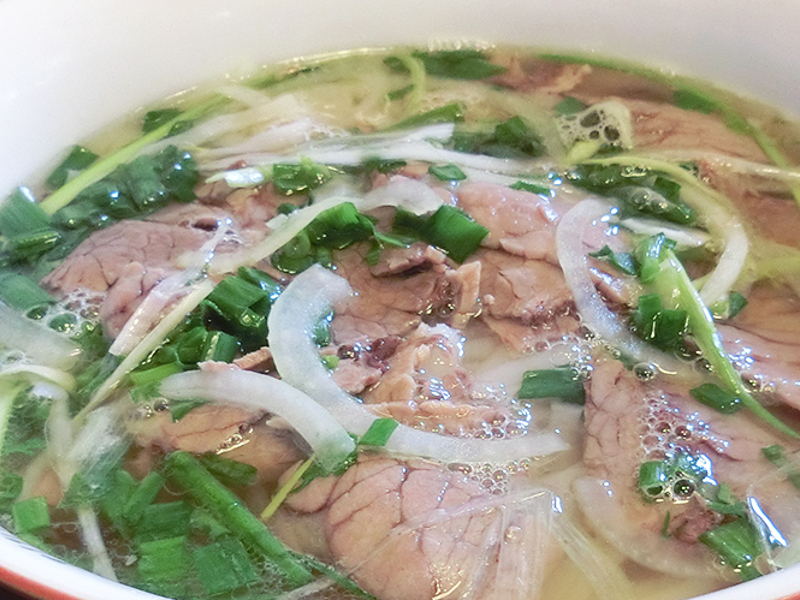
Where is `white bowl`? This screenshot has width=800, height=600. white bowl is located at coordinates (58, 572).